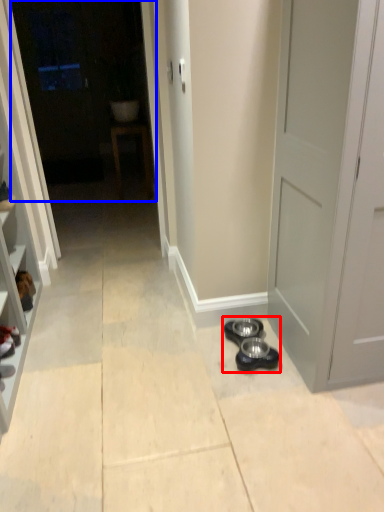
Question: Which object is further to the camera taking this photo, shoe (highlighted by a red box) or glass door (highlighted by a blue box)?

Choices:
 (A) shoe
 (B) glass door

Answer: (B)